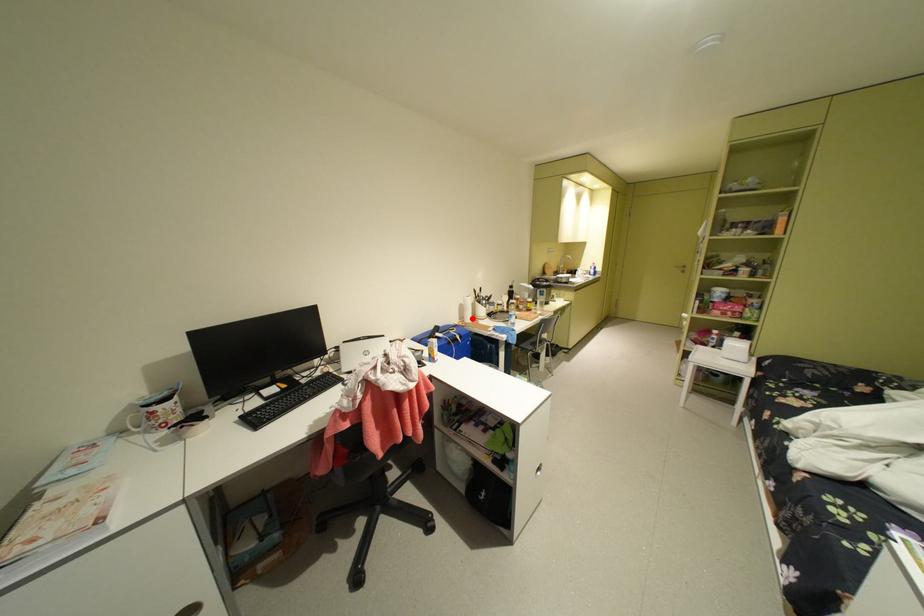
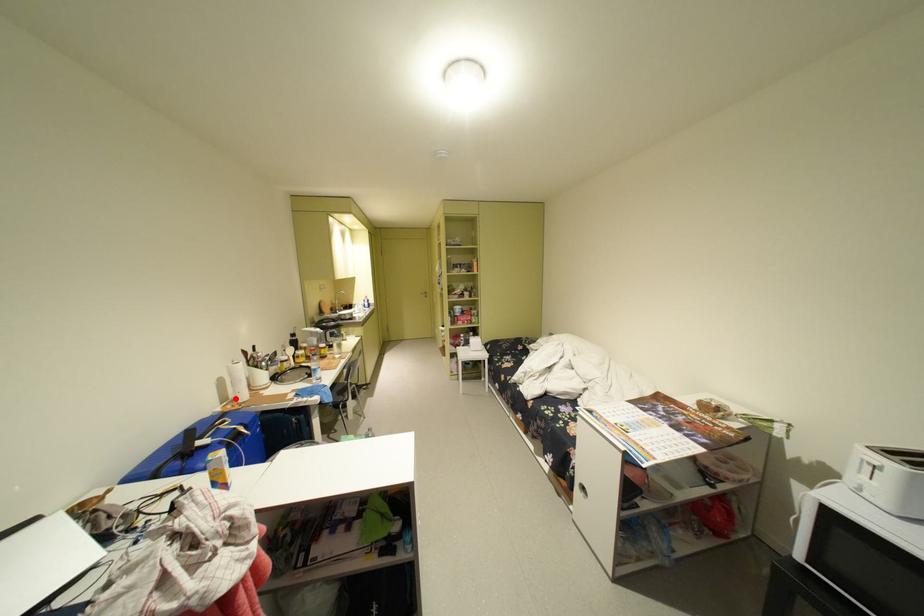
I am providing you with two images of the same scene from different viewpoints. A red point is marked on the first image and another point is marked on the second image. Do the highlighted points in image1 and image2 indicate the same real-world spot?

Yes